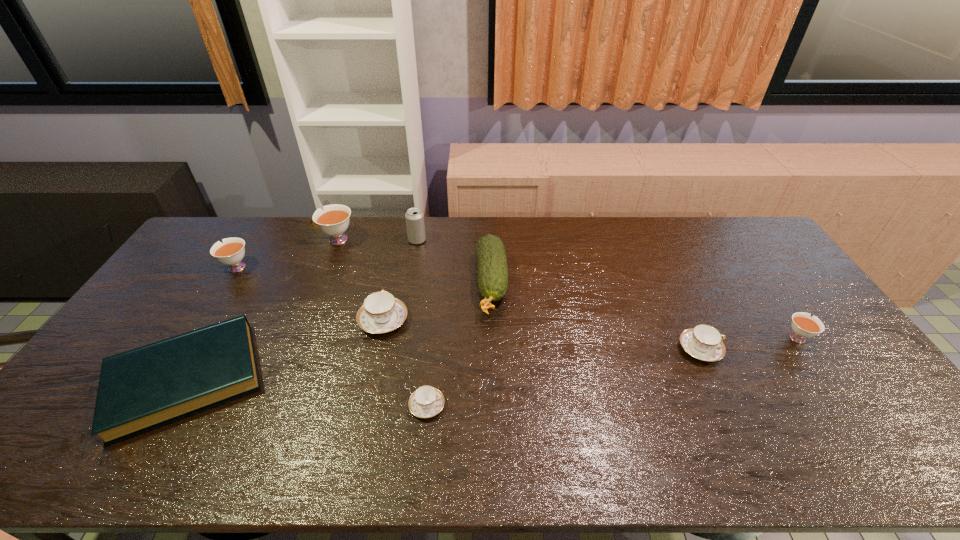
Where is `free space that is in between the seventh object from left to right and the white beer can`? free space that is in between the seventh object from left to right and the white beer can is located at coordinates (454, 262).

Locate an element on the screen. vacant area that lies between the green cucumber and the second farthest teacup is located at coordinates (363, 275).

Choose which object is the seventh nearest neighbor to the seventh object from left to right. Please provide its 2D coordinates. Your answer should be formatted as a tuple, i.e. [(x, y)], where the tuple contains the x and y coordinates of a point satisfying the conditions above.

[(230, 252)]

I want to click on object that is the sixth closest to the book, so click(492, 265).

You are a GUI agent. You are given a task and a screenshot of the screen. Output one action in this format:
    pyautogui.click(x=<x>, y=<y>)
    Task: Click on the fourth closest teacup to the leftmost teacup
    
    Given the screenshot: What is the action you would take?
    pyautogui.click(x=703, y=342)

Identify which teacup is the fifth nearest to the shortest object. Please provide its 2D coordinates. Your answer should be formatted as a tuple, i.e. [(x, y)], where the tuple contains the x and y coordinates of a point satisfying the conditions above.

[(804, 326)]

Where is `the closest white teacup relative to the green cucumber`? Image resolution: width=960 pixels, height=540 pixels. the closest white teacup relative to the green cucumber is located at coordinates (334, 220).

This screenshot has height=540, width=960. I want to click on the second closest white teacup relative to the second farthest teacup, so click(x=804, y=326).

At what (x,y) coordinates should I click in order to perform the action: click on the closest blue teacup to the tallest teacup. Please return your answer as a coordinate pair (x, y). Looking at the image, I should click on (381, 312).

What are the coordinates of `blue teacup that can be found as the second closest to the farthest white teacup` in the screenshot? It's located at (427, 401).